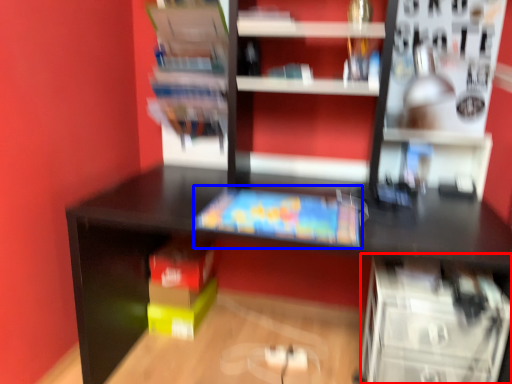
Question: Which object is closer to the camera taking this photo, shelf (highlighted by a red box) or book (highlighted by a blue box)?

Choices:
 (A) shelf
 (B) book

Answer: (A)